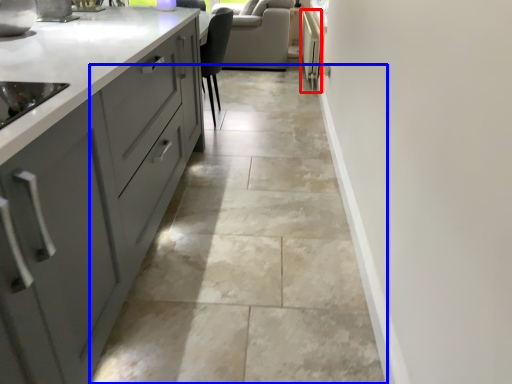
Question: Which of the following is the farthest to the observer, appliance (highlighted by a red box) or granite (highlighted by a blue box)?

Choices:
 (A) appliance
 (B) granite

Answer: (A)